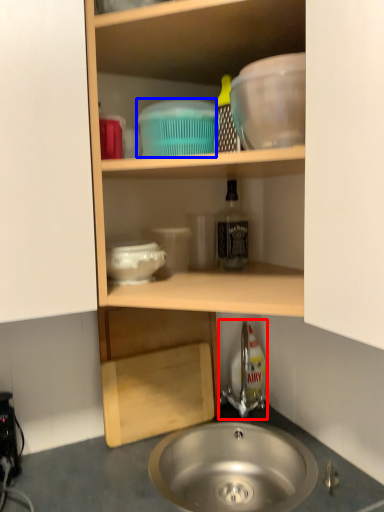
Question: Which object is further to the camera taking this photo, tap (highlighted by a red box) or basin (highlighted by a blue box)?

Choices:
 (A) tap
 (B) basin

Answer: (A)